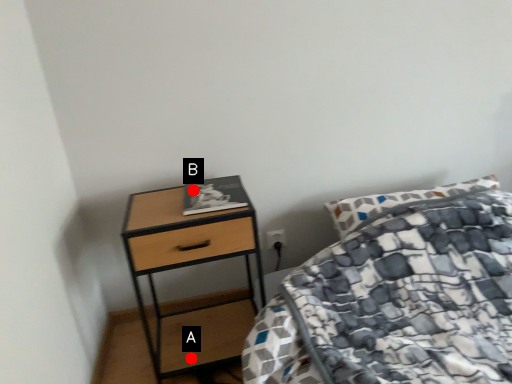
Question: Two points are circled on the image, labeled by A and B beside each circle. Which point is further to the camera?

Choices:
 (A) A is further
 (B) B is further

Answer: (A)